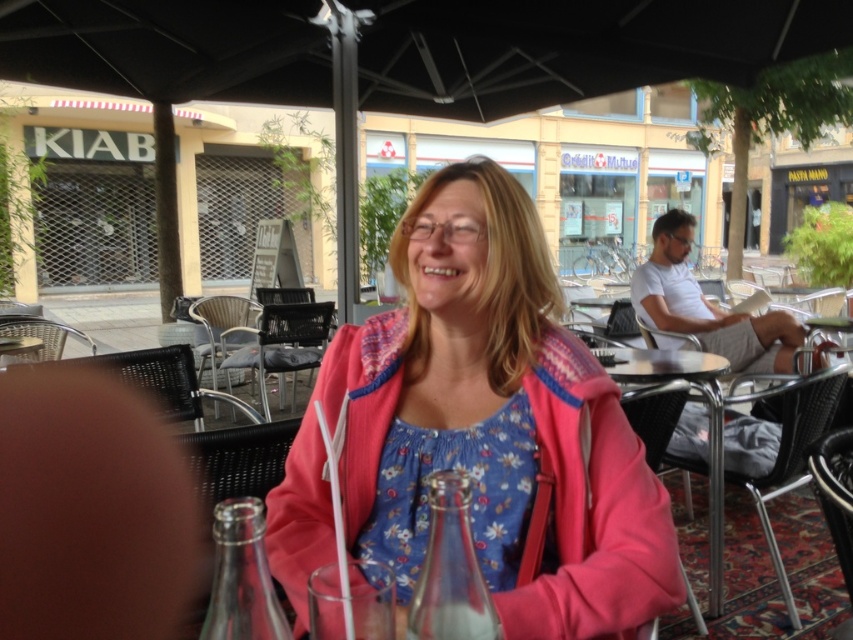
Question: Which object is closer to the camera taking this photo?

Choices:
 (A) pink fleece jacket at center
 (B) metallic silver table at center

Answer: (A)

Question: Where is pink fleece jacket at center located in relation to metallic silver table at center in the image?

Choices:
 (A) below
 (B) above

Answer: (B)

Question: Is pink fleece jacket at center above metallic silver table at center?

Choices:
 (A) yes
 (B) no

Answer: (A)

Question: Which object appears farthest from the camera in this image?

Choices:
 (A) pink fleece jacket at center
 (B) metallic silver table at center

Answer: (B)

Question: Is pink fleece jacket at center wider than metallic silver table at center?

Choices:
 (A) no
 (B) yes

Answer: (B)